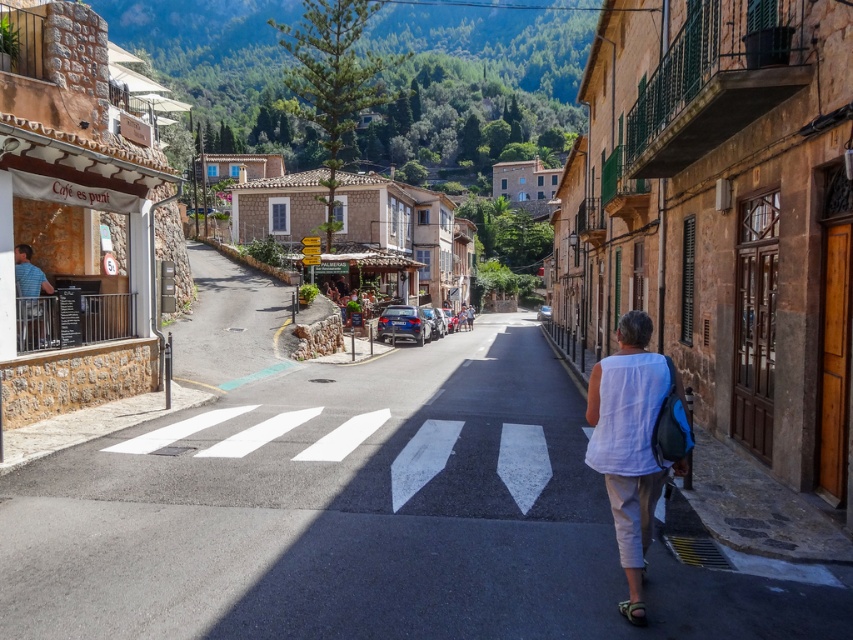
You are a tourist standing at the pedestrian crossing in the middle of the asphalt road at center. You want to take a photo of the white cotton shirt at lower right. Which direction should you move to get the best view?

The asphalt road at center is located below the white cotton shirt at lower right. To get the best view of the white cotton shirt at lower right, you should move upward from the asphalt road at center towards the white cotton shirt at lower right.